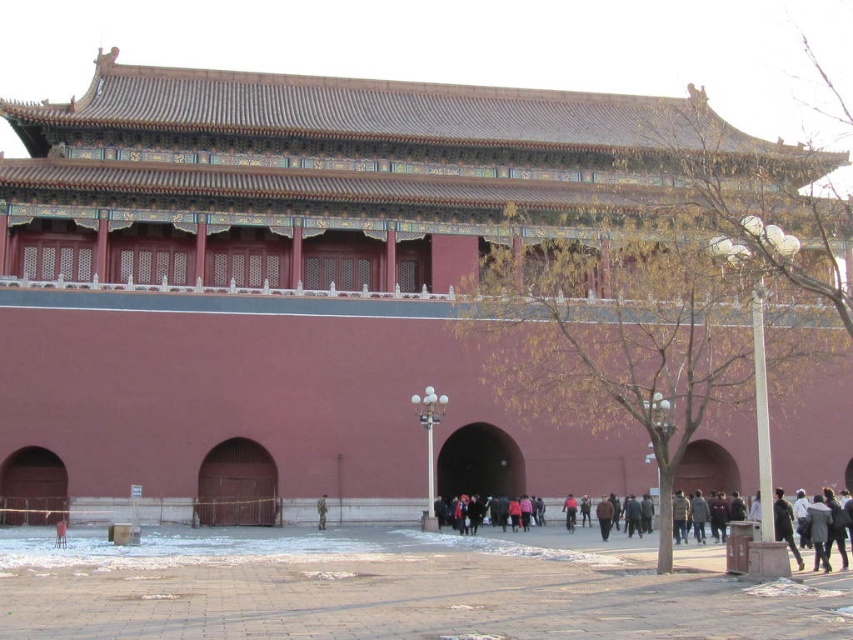
You are a photographer standing in front of the traditional Chinese gate. You notice the brick pavement at center and the dark gray sweater at center. Which object is closer to the ground?

The brick pavement at center is closer to the ground because it has a lesser height compared to the dark gray sweater at center.

Looking at this image, you are a photographer planning to take a picture of the brick pavement at center and the camouflage uniform at center in the scene. Which object should be placed closer to the camera to ensure both are in focus?

The brick pavement at center is much taller than the camouflage uniform at center, so to ensure both are in focus, the camouflage uniform at center should be placed closer to the camera.

You are standing in front of a traditional Chinese gate with red walls and a curved roof. You see a brick pavement at center and a camouflage uniform at center. Which object is located to the right of the other?

The brick pavement at center is to the right of the camouflage uniform at center.